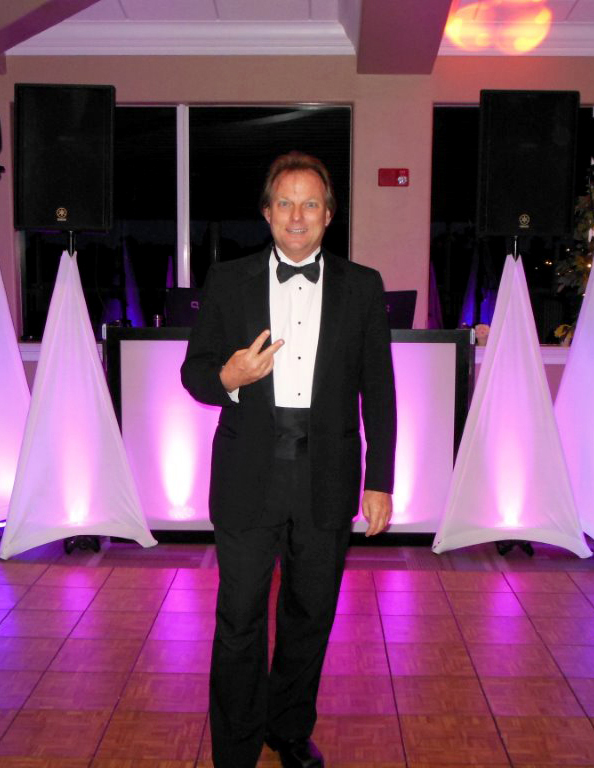
In order to click on large black speakers in this screenshot , I will do (x=60, y=160), (x=508, y=189).